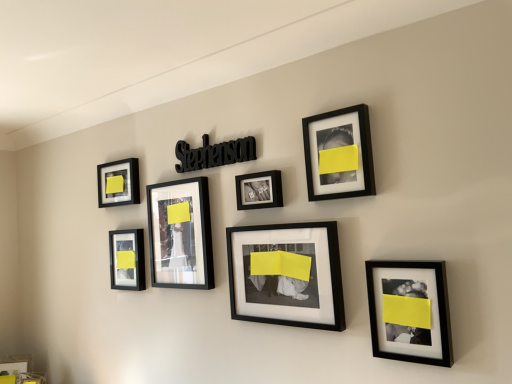
Question: Does black matte picture frame at lower right, which ranks as the 7th picture frame in left-to-right order, turn towards matte black picture frame at lower left, the 6th picture frame when ordered from right to left?

Choices:
 (A) no
 (B) yes

Answer: (A)

Question: Would you consider black matte picture frame at lower right, acting as the 1th picture frame starting from the right, to be distant from matte black picture frame at lower left, the 6th picture frame when ordered from right to left?

Choices:
 (A) no
 (B) yes

Answer: (B)

Question: Can you confirm if black matte picture frame at lower right, acting as the 1th picture frame starting from the right, is wider than matte black picture frame at lower left, the 2th picture frame in the left-to-right sequence?

Choices:
 (A) no
 (B) yes

Answer: (B)

Question: Is black matte picture frame at lower right, acting as the 1th picture frame starting from the right, shorter than matte black picture frame at lower left, the 6th picture frame when ordered from right to left?

Choices:
 (A) yes
 (B) no

Answer: (B)

Question: From a real-world perspective, is black matte picture frame at lower right, which ranks as the 7th picture frame in left-to-right order, below matte black picture frame at lower left, the 2th picture frame in the left-to-right sequence?

Choices:
 (A) no
 (B) yes

Answer: (B)

Question: Is black matte picture frame at lower right, acting as the 1th picture frame starting from the right, in front of or behind matte black frame at center, which ranks as the 3th picture frame in left-to-right order, in the image?

Choices:
 (A) behind
 (B) front

Answer: (B)

Question: Is black matte picture frame at lower right, acting as the 1th picture frame starting from the right, taller or shorter than matte black frame at center, the fifth picture frame in the right-to-left sequence?

Choices:
 (A) tall
 (B) short

Answer: (B)

Question: From a real-world perspective, is black matte picture frame at lower right, which ranks as the 7th picture frame in left-to-right order, positioned above or below matte black frame at center, the fifth picture frame in the right-to-left sequence?

Choices:
 (A) below
 (B) above

Answer: (A)

Question: Is point (401, 291) closer or farther from the camera than point (193, 283)?

Choices:
 (A) farther
 (B) closer

Answer: (B)

Question: In the image, is matte black frame at center, which ranks as the 3th picture frame in left-to-right order, positioned in front of or behind matte black photo frame at center, positioned as the 4th picture frame in left-to-right order?

Choices:
 (A) front
 (B) behind

Answer: (B)

Question: Is matte black frame at center, the fifth picture frame in the right-to-left sequence, spatially inside matte black photo frame at center, marked as the 4th picture frame in a right-to-left arrangement, or outside of it?

Choices:
 (A) outside
 (B) inside

Answer: (A)

Question: Considering the positions of matte black frame at center, the fifth picture frame in the right-to-left sequence, and matte black photo frame at center, marked as the 4th picture frame in a right-to-left arrangement, in the image, is matte black frame at center, the fifth picture frame in the right-to-left sequence, bigger or smaller than matte black photo frame at center, marked as the 4th picture frame in a right-to-left arrangement,?

Choices:
 (A) small
 (B) big

Answer: (B)

Question: From a real-world perspective, relative to matte black photo frame at center, positioned as the 4th picture frame in left-to-right order, is matte black frame at center, which ranks as the 3th picture frame in left-to-right order, vertically above or below?

Choices:
 (A) below
 (B) above

Answer: (A)

Question: Looking at the image, does matte black picture frame at upper left, acting as the first picture frame starting from the left, seem bigger or smaller compared to matte black picture frame at lower left, the 2th picture frame in the left-to-right sequence?

Choices:
 (A) big
 (B) small

Answer: (B)

Question: Considering the positions of matte black picture frame at upper left, which ranks as the seventh picture frame in right-to-left order, and matte black picture frame at lower left, the 2th picture frame in the left-to-right sequence, in the image, is matte black picture frame at upper left, which ranks as the seventh picture frame in right-to-left order, taller or shorter than matte black picture frame at lower left, the 2th picture frame in the left-to-right sequence,?

Choices:
 (A) short
 (B) tall

Answer: (A)